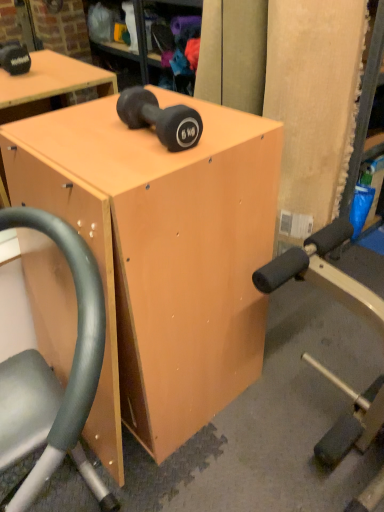
Image resolution: width=384 pixels, height=512 pixels. In order to click on free region on the left part of matte black dumbbell at center in this screenshot , I will do `click(83, 139)`.